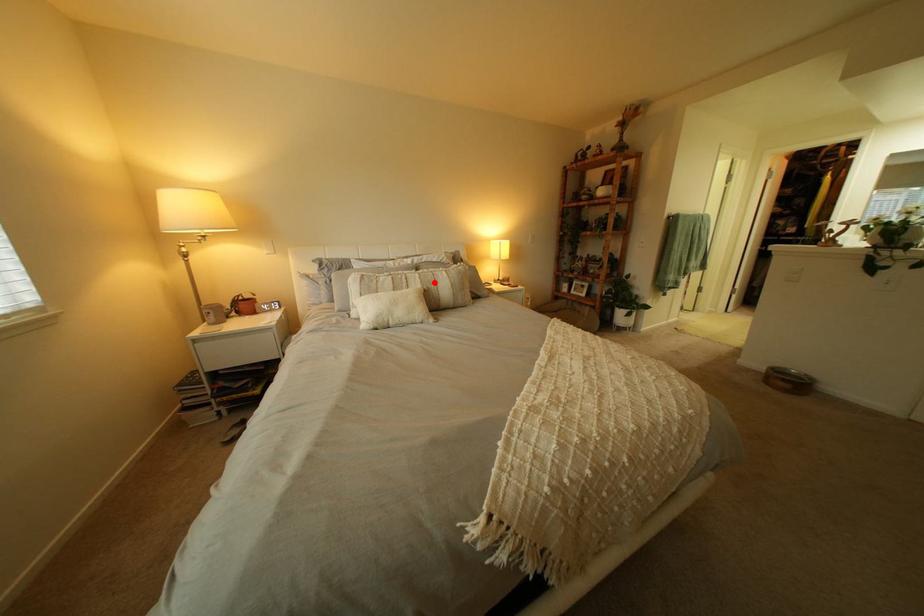
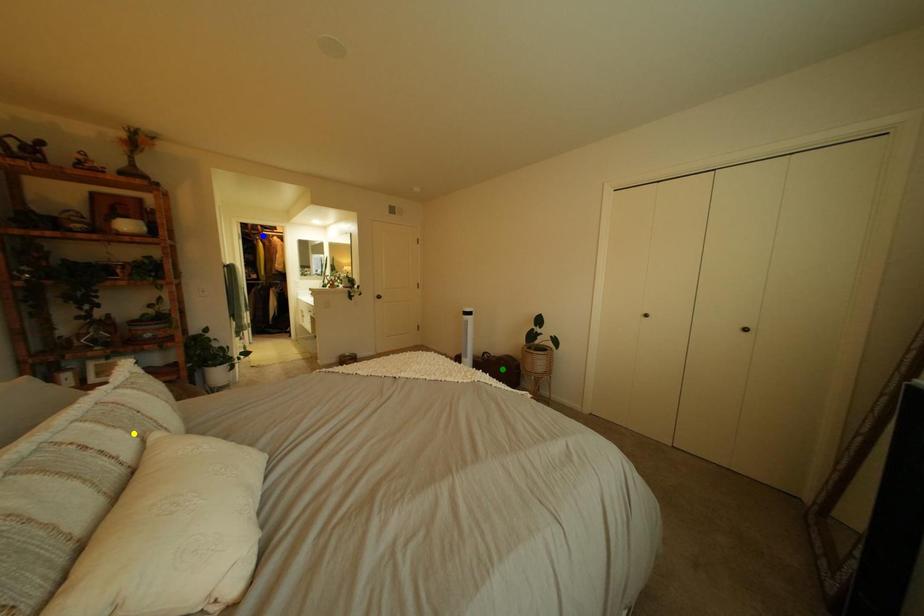
Question: I am providing you with two images of the same scene from different viewpoints. A red point is marked on the first image. You are given multiple points on the second image. In image 2, which mark is for the same physical point as the one in image 1?

Choices:
 (A) green point
 (B) yellow point
 (C) blue point

Answer: (B)